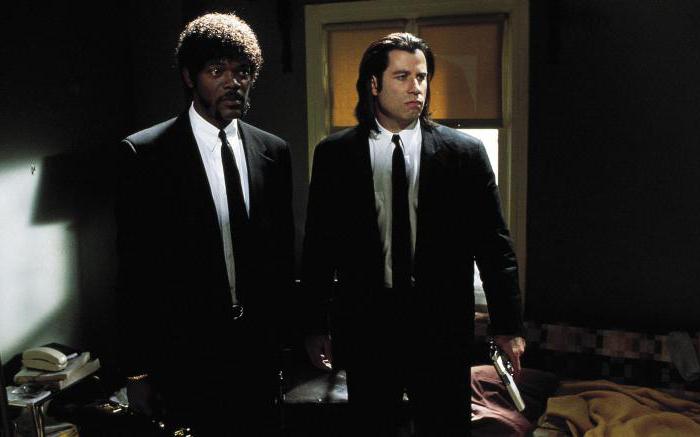
At what (x,y) coordinates should I click in order to perform the action: click on walls. Please return your answer as a coordinate pair (x, y). Looking at the image, I should click on (617, 230), (106, 74).